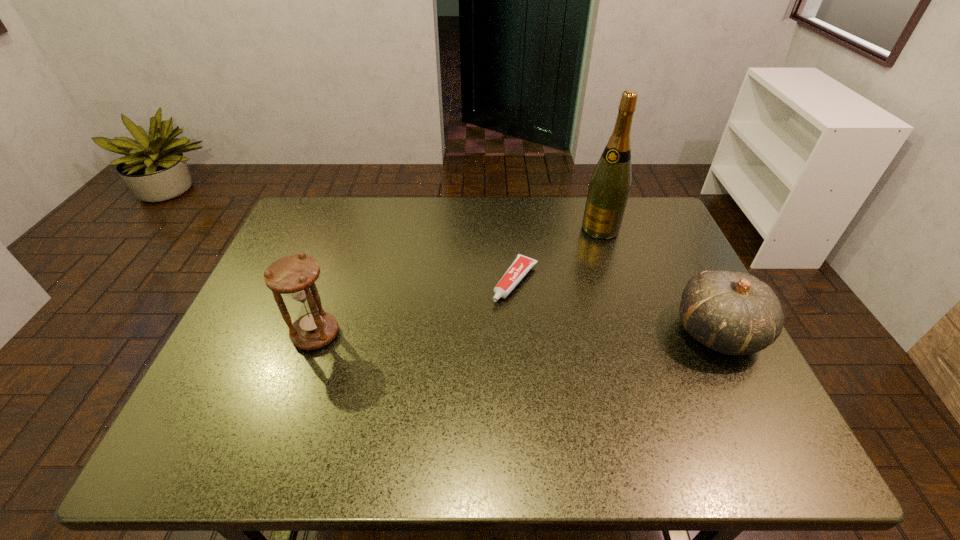
The height and width of the screenshot is (540, 960). I want to click on object that is at the far right corner, so click(609, 188).

This screenshot has width=960, height=540. What are the coordinates of `free space at the far edge of the desktop` in the screenshot? It's located at (391, 205).

Locate an element on the screen. This screenshot has height=540, width=960. vacant space at the near edge of the desktop is located at coordinates (304, 404).

The width and height of the screenshot is (960, 540). In the image, there is a desktop. What are the coordinates of `free space at the left edge` in the screenshot? It's located at (220, 358).

Image resolution: width=960 pixels, height=540 pixels. I want to click on vacant space at the right edge of the desktop, so click(679, 341).

The height and width of the screenshot is (540, 960). In order to click on vacant space at the far left corner of the desktop in this screenshot , I will do point(310,237).

Find the location of a particular element. vacant space at the near left corner of the desktop is located at coordinates coord(220,381).

Find the location of a particular element. Image resolution: width=960 pixels, height=540 pixels. free space that is in between the gourd and the leftmost object is located at coordinates (516, 333).

The image size is (960, 540). I want to click on free point between the third shortest object and the second object from right to left, so click(458, 281).

This screenshot has height=540, width=960. In order to click on unoccupied area between the toothpaste and the second tallest object in this screenshot , I will do `click(416, 308)`.